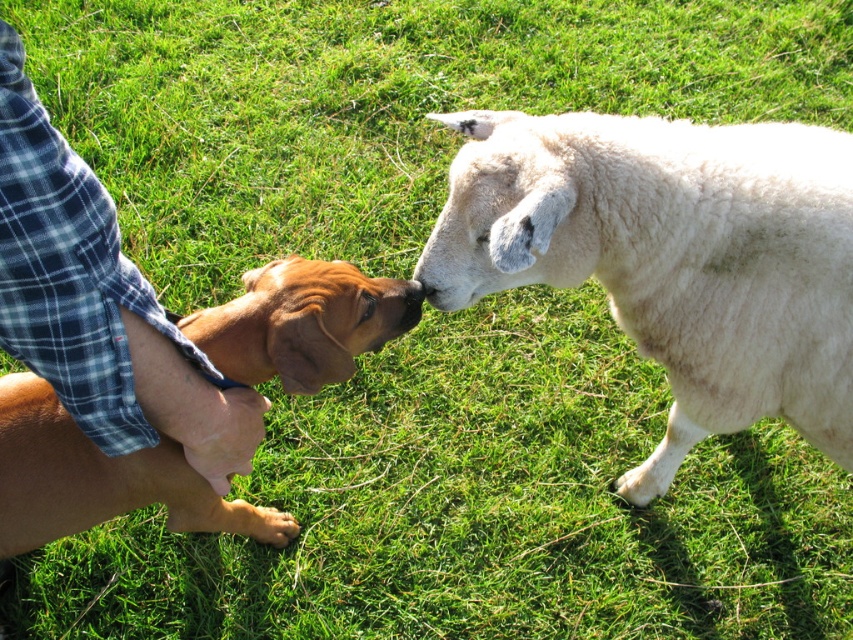
Question: Which of the following is the closest to the observer?

Choices:
 (A) white woolen sheep at center
 (B) brown furry dog at left

Answer: (B)

Question: Among these objects, which one is farthest from the camera?

Choices:
 (A) white woolen sheep at center
 (B) black smooth nose at center
 (C) brown furry dog at left

Answer: (B)

Question: Can you confirm if white woolen sheep at center is wider than black smooth nose at center?

Choices:
 (A) no
 (B) yes

Answer: (B)

Question: Which object appears farthest from the camera in this image?

Choices:
 (A) blue plaid shirt at lower left
 (B) black smooth nose at center
 (C) brown furry dog at left

Answer: (B)

Question: Does blue plaid shirt at lower left have a lesser width compared to black smooth nose at center?

Choices:
 (A) no
 (B) yes

Answer: (A)

Question: In this image, where is blue plaid shirt at lower left located relative to black smooth nose at center?

Choices:
 (A) left
 (B) right

Answer: (A)